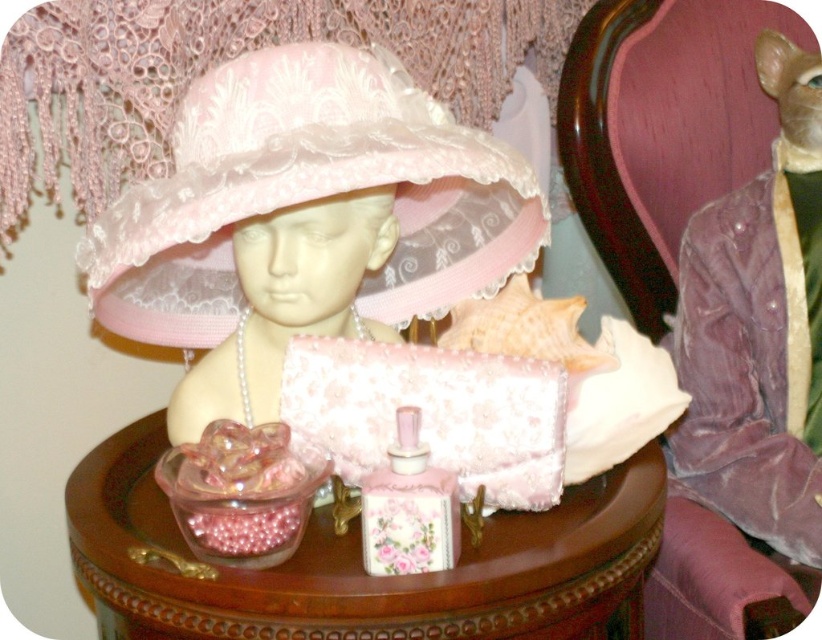
Can you confirm if pink wood table at center is taller than velvet purple chair at upper right?

Incorrect, pink wood table at center's height is not larger of velvet purple chair at upper right's.

At what (x,y) coordinates should I click in order to perform the action: click on pink wood table at center. Please return your answer as a coordinate pair (x, y). The image size is (822, 640). Looking at the image, I should click on (359, 564).

This screenshot has width=822, height=640. I want to click on pink wood table at center, so point(359,564).

Who is positioned more to the left, pink wood table at center or matte pink lace hat at center?

matte pink lace hat at center is more to the left.

This screenshot has width=822, height=640. Describe the element at coordinates (359, 564) in the screenshot. I see `pink wood table at center` at that location.

Locate an element on the screen. The height and width of the screenshot is (640, 822). pink wood table at center is located at coordinates (359, 564).

Is matte pink lace hat at center in front of velvet purple chair at upper right?

Yes.

Does matte pink lace hat at center appear under velvet purple chair at upper right?

Indeed, matte pink lace hat at center is positioned under velvet purple chair at upper right.

Who is more distant from viewer, [275,280] or [578,212]?

Positioned behind is point [578,212].

This screenshot has height=640, width=822. I want to click on matte pink lace hat at center, so click(287, 301).